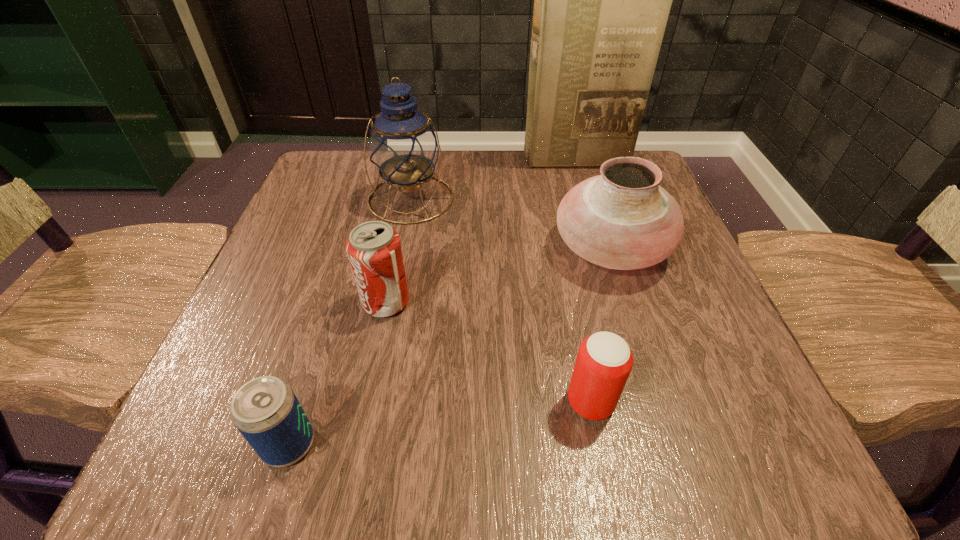
Locate an element on the screen. The image size is (960, 540). vacant region located on the right of the soda can is located at coordinates (633, 302).

In order to click on free space located 0.060m on the back of the right beer can in this screenshot , I will do `click(580, 347)`.

Where is `vacant region located on the back of the left beer can`? vacant region located on the back of the left beer can is located at coordinates (353, 239).

The width and height of the screenshot is (960, 540). Identify the location of phonebook located at the far edge. (602, 0).

Identify the location of lantern located at the far edge. (403, 145).

Identify the location of lantern that is positioned at the left edge. (403, 145).

Find the location of a particular element. The image size is (960, 540). beer can situated at the left edge is located at coordinates (265, 410).

Find the location of a particular element. This screenshot has height=540, width=960. phonebook that is at the right edge is located at coordinates (602, 0).

Where is `pottery positioned at the right edge`? This screenshot has height=540, width=960. pottery positioned at the right edge is located at coordinates (622, 219).

This screenshot has width=960, height=540. What are the coordinates of `object located at the far left corner` in the screenshot? It's located at (403, 145).